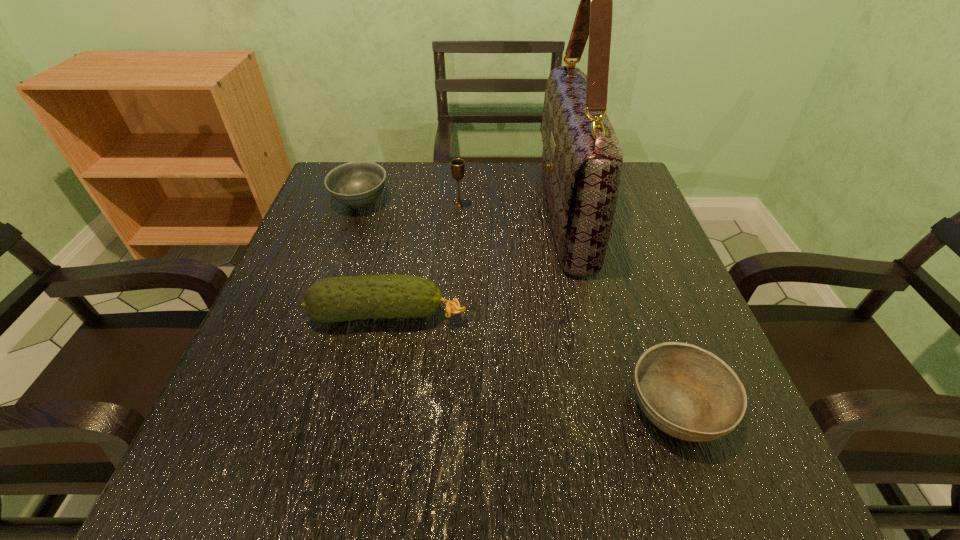
The width and height of the screenshot is (960, 540). In order to click on free point between the farther bowl and the handbag in this screenshot , I will do `click(463, 207)`.

Find the location of a particular element. The width and height of the screenshot is (960, 540). the fourth closest object to the tallest object is located at coordinates (359, 183).

Point out which object is positioned as the second nearest to the left bowl. Please provide its 2D coordinates. Your answer should be formatted as a tuple, i.e. [(x, y)], where the tuple contains the x and y coordinates of a point satisfying the conditions above.

[(346, 298)]

This screenshot has height=540, width=960. I want to click on free location that satisfies the following two spatial constraints: 1. on the back side of the nearer bowl; 2. on the front of the handbag with the clasp, so click(x=610, y=214).

This screenshot has width=960, height=540. What are the coordinates of `vacant space that satisfies the following two spatial constraints: 1. on the front side of the chalice; 2. at the blossom end of the third tallest object` in the screenshot? It's located at (453, 315).

This screenshot has height=540, width=960. Find the location of `vacant point that satisfies the following two spatial constraints: 1. on the front of the nearest object with the clasp; 2. on the left side of the tallest object`. vacant point that satisfies the following two spatial constraints: 1. on the front of the nearest object with the clasp; 2. on the left side of the tallest object is located at coordinates (610, 406).

The height and width of the screenshot is (540, 960). Find the location of `free location that satisfies the following two spatial constraints: 1. at the blossom end of the third shortest object; 2. on the back side of the right bowl`. free location that satisfies the following two spatial constraints: 1. at the blossom end of the third shortest object; 2. on the back side of the right bowl is located at coordinates (371, 406).

I want to click on free space that satisfies the following two spatial constraints: 1. on the front side of the farther bowl; 2. on the left side of the nearer bowl, so click(x=291, y=406).